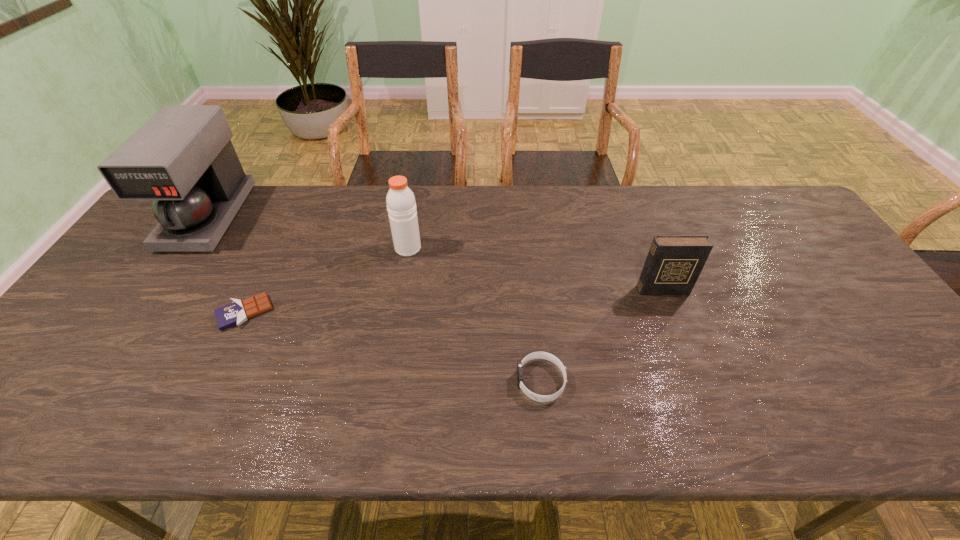
Locate an element on the screen. The width and height of the screenshot is (960, 540). free space between the fourth object from right to left and the nearest object is located at coordinates (393, 347).

Image resolution: width=960 pixels, height=540 pixels. What are the coordinates of `vacant space that's between the fourth shortest object and the tallest object` in the screenshot? It's located at (308, 232).

The image size is (960, 540). What are the coordinates of `unoccupied area between the wristband and the third tallest object` in the screenshot? It's located at (602, 335).

Where is `vacant space that's between the tallest object and the shortest object`? The height and width of the screenshot is (540, 960). vacant space that's between the tallest object and the shortest object is located at coordinates (227, 265).

This screenshot has width=960, height=540. Find the location of `vacant area that lies between the chocolate bar and the leftmost object`. vacant area that lies between the chocolate bar and the leftmost object is located at coordinates (227, 265).

Where is `object that is the closest to the coffee maker`? The width and height of the screenshot is (960, 540). object that is the closest to the coffee maker is located at coordinates (237, 312).

Identify which object is the second closest to the rightmost object. Please provide its 2D coordinates. Your answer should be formatted as a tuple, i.e. [(x, y)], where the tuple contains the x and y coordinates of a point satisfying the conditions above.

[(401, 205)]

Find the location of `vacant space that satisfies the following two spatial constraints: 1. on the front cover of the third tallest object; 2. on the outer surface of the wristband`. vacant space that satisfies the following two spatial constraints: 1. on the front cover of the third tallest object; 2. on the outer surface of the wristband is located at coordinates (697, 381).

This screenshot has height=540, width=960. What are the coordinates of `blank space that satisfies the following two spatial constraints: 1. on the carafe side of the shortest object; 2. on the right side of the tallest object` in the screenshot? It's located at tap(143, 313).